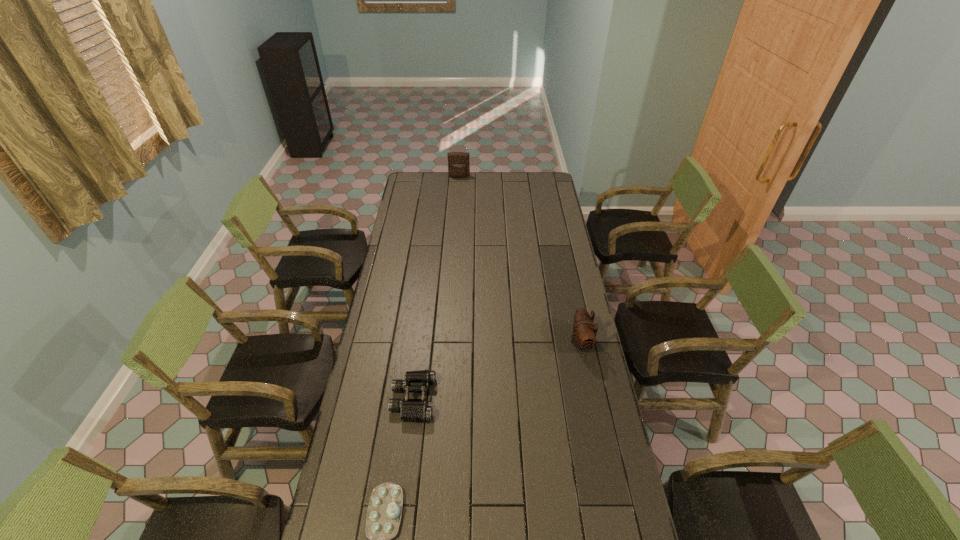
Where is `free space located on the front-facing side of the second shortest object`? This screenshot has width=960, height=540. free space located on the front-facing side of the second shortest object is located at coordinates (469, 399).

What are the coordinates of `object that is at the far edge` in the screenshot? It's located at (458, 162).

Identify the location of object located in the left edge section of the desktop. The height and width of the screenshot is (540, 960). (418, 410).

Image resolution: width=960 pixels, height=540 pixels. I want to click on object that is at the right edge, so coord(584,332).

Find the location of `free spot at the far edge of the desktop`. free spot at the far edge of the desktop is located at coordinates (457, 191).

Locate an element on the screen. Image resolution: width=960 pixels, height=540 pixels. blank space at the left edge of the desktop is located at coordinates (411, 232).

What are the coordinates of `vacant space at the right edge of the desktop` in the screenshot? It's located at (583, 353).

The height and width of the screenshot is (540, 960). Identify the location of unoccupied area between the rightmost object and the binoculars. (497, 370).

This screenshot has width=960, height=540. Identify the location of free spot between the nearer pouch and the second shortest object. (497, 370).

Locate an element on the screen. vacant space in between the rightmost object and the third farthest object is located at coordinates (497, 370).